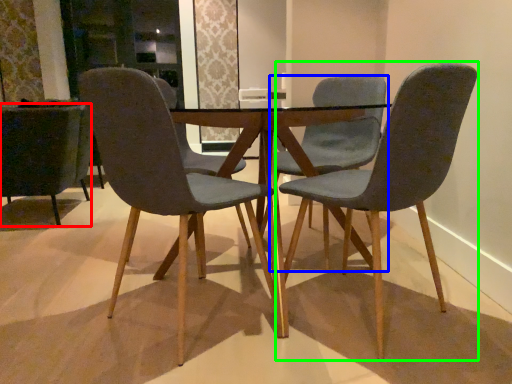
Question: Which object is positioned closest to chair (highlighted by a red box)? Select from chair (highlighted by a blue box) and chair (highlighted by a green box).

Choices:
 (A) chair
 (B) chair

Answer: (A)